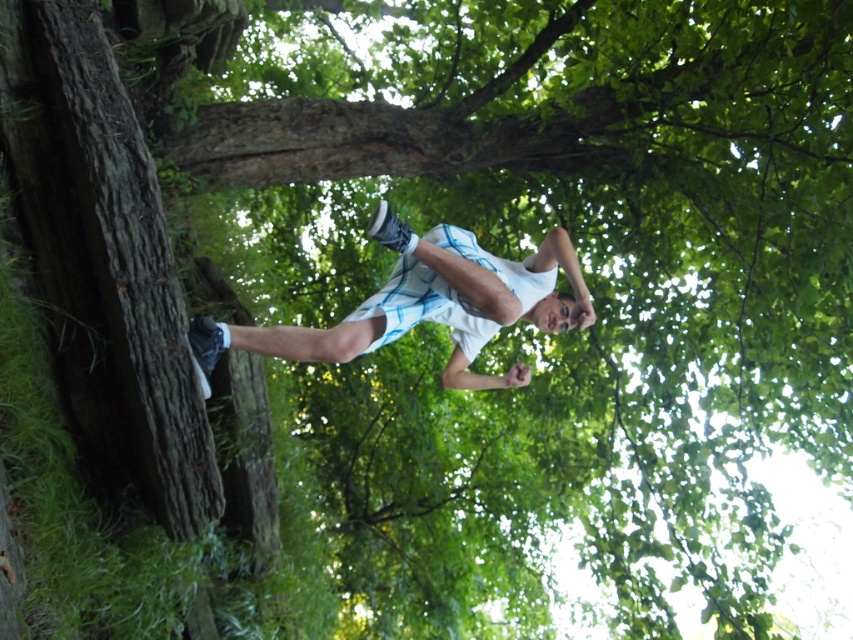
Who is shorter, rough bark tree trunk at left or white matte shorts at center?

With less height is white matte shorts at center.

Who is more distant from viewer, (77, 401) or (503, 308)?

The point (503, 308) is more distant.

Describe the element at coordinates (106, 268) in the screenshot. This screenshot has height=640, width=853. I see `rough bark tree trunk at left` at that location.

Find the location of `rough bark tree trunk at left`. rough bark tree trunk at left is located at coordinates (106, 268).